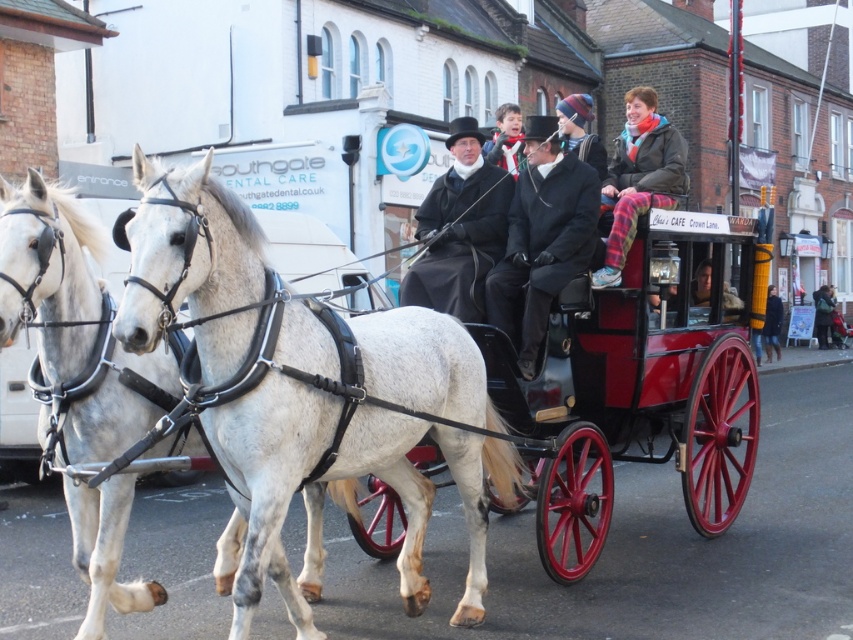
Can you confirm if white leather harness at left is positioned above dark green coat at center?

No, white leather harness at left is not above dark green coat at center.

Is white leather harness at left in front of dark green coat at center?

Yes, white leather harness at left is closer to the viewer.

Who is more forward, (16, 188) or (813, 298)?

Point (16, 188) is in front.

Where is `white leather harness at left`? This screenshot has width=853, height=640. white leather harness at left is located at coordinates (73, 323).

Does white speckled fur at center appear under white leather harness at left?

Correct, white speckled fur at center is located below white leather harness at left.

Does white speckled fur at center lie behind white leather harness at left?

No, white speckled fur at center is in front of white leather harness at left.

Between point (123, 298) and point (70, 289), which one is positioned in front?

Point (123, 298) is more forward.

Find the location of a particular element. white speckled fur at center is located at coordinates (190, 264).

Can you confirm if white leather harness at left is bigger than dark blue denim jacket at lower right?

Incorrect, white leather harness at left is not larger than dark blue denim jacket at lower right.

Which is in front, point (33, 282) or point (770, 304)?

Point (33, 282)

Where is `white leather harness at left`? This screenshot has width=853, height=640. white leather harness at left is located at coordinates (73, 323).

The height and width of the screenshot is (640, 853). I want to click on white leather harness at left, so click(x=73, y=323).